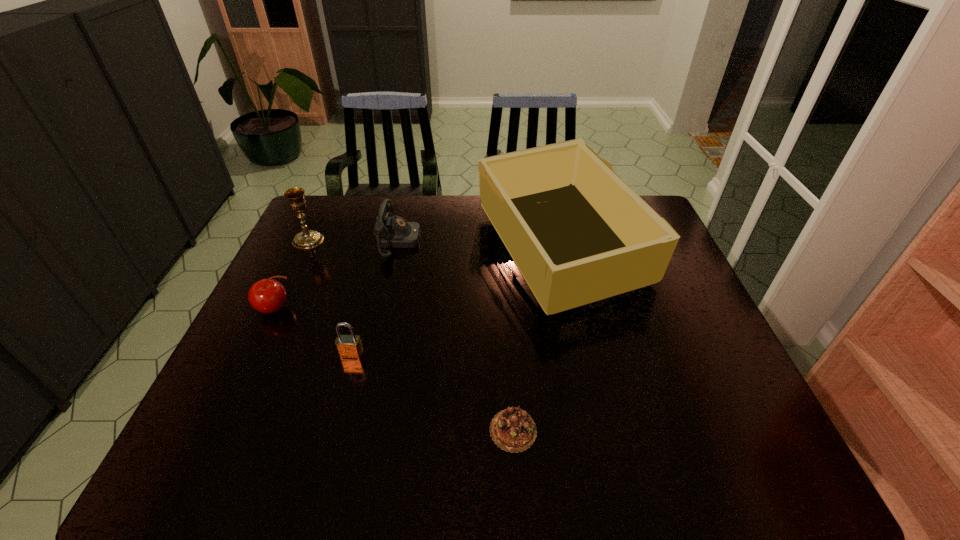
Image resolution: width=960 pixels, height=540 pixels. What are the coordinates of `box` in the screenshot? It's located at (577, 233).

Locate an element on the screen. the second tallest object is located at coordinates (307, 239).

Where is `telephone`? The height and width of the screenshot is (540, 960). telephone is located at coordinates (391, 232).

Locate an element on the screen. cherry is located at coordinates (268, 296).

Locate an element on the screen. The image size is (960, 540). padlock is located at coordinates (x=348, y=346).

Identify the location of the shortest object. Image resolution: width=960 pixels, height=540 pixels. click(513, 430).

The height and width of the screenshot is (540, 960). I want to click on chocolate cake, so click(513, 430).

Where is `vacant area located 0.270m on the left of the tallest object`? The image size is (960, 540). vacant area located 0.270m on the left of the tallest object is located at coordinates [x=390, y=248].

Locate an element on the screen. The height and width of the screenshot is (540, 960). vacant space located 0.220m on the front of the chalice is located at coordinates 280,299.

Find the location of `vacant space located on the dial of the telephone`. vacant space located on the dial of the telephone is located at coordinates (524, 241).